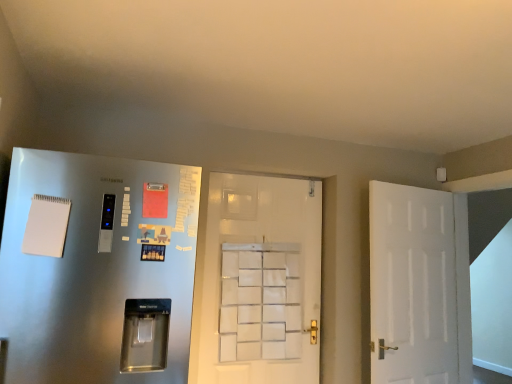
Question: Is satin silver refrigerator at left, which ranks as the third door in right-to-left order, inside the boundaries of white matte door at right, the 3th door when ordered from left to right, or outside?

Choices:
 (A) inside
 (B) outside

Answer: (B)

Question: From the image's perspective, is satin silver refrigerator at left, which ranks as the third door in right-to-left order, located above or below white matte door at right, marked as the 1th door in a right-to-left arrangement?

Choices:
 (A) above
 (B) below

Answer: (A)

Question: Which object is positioned farthest from the satin silver refrigerator at left, which ranks as the third door in right-to-left order?

Choices:
 (A) white matte door at center, marked as the second door in a right-to-left arrangement
 (B) white matte door at right, the 3th door when ordered from left to right

Answer: (B)

Question: Which is farther from the white matte door at center, which is counted as the 2th door, starting from the left?

Choices:
 (A) satin silver refrigerator at left, arranged as the first door when viewed from the left
 (B) white matte door at right, marked as the 1th door in a right-to-left arrangement

Answer: (A)